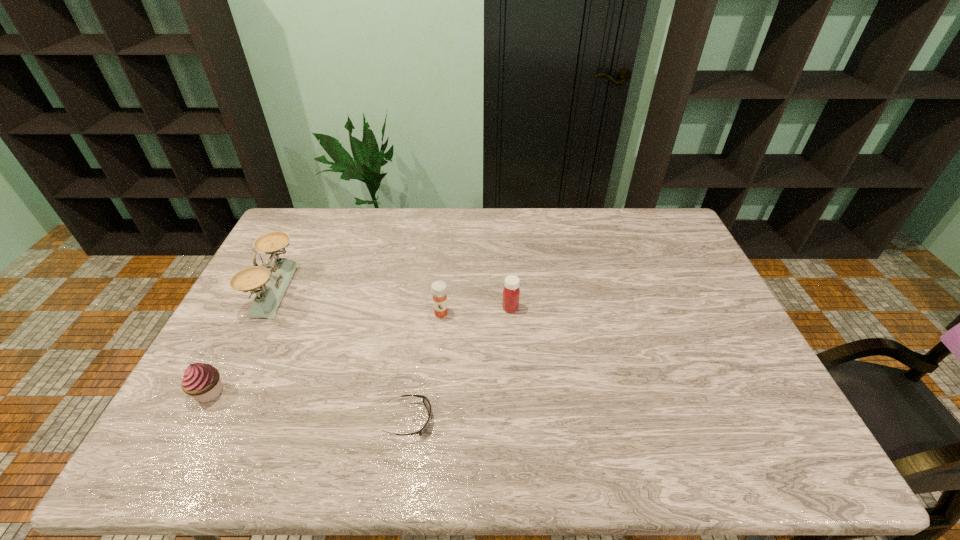
Identify the location of object that is at the near edge. (426, 402).

The height and width of the screenshot is (540, 960). I want to click on scale positioned at the left edge, so click(x=272, y=284).

Locate an element on the screen. cupcake present at the left edge is located at coordinates (202, 381).

This screenshot has height=540, width=960. In order to click on free space at the far edge of the desktop in this screenshot , I will do `click(597, 244)`.

The width and height of the screenshot is (960, 540). In order to click on vacant area at the near edge in this screenshot , I will do `click(652, 448)`.

Locate an element on the screen. vacant position at the left edge of the desktop is located at coordinates (291, 250).

The image size is (960, 540). Identify the location of vacant space at the right edge of the desktop. [x=777, y=416].

You are a GUI agent. You are given a task and a screenshot of the screen. Output one action in this format:
    pyautogui.click(x=<x>, y=<y>)
    Task: Click on the vacant area that lies between the scale and the cupcake
    The height and width of the screenshot is (540, 960).
    Given the screenshot: What is the action you would take?
    pyautogui.click(x=242, y=341)

The height and width of the screenshot is (540, 960). In order to click on free spot between the cupcake and the shortest object in this screenshot , I will do `click(309, 406)`.

You are a GUI agent. You are given a task and a screenshot of the screen. Output one action in this format:
    pyautogui.click(x=<x>, y=<y>)
    Task: Click on the empty space that is in between the left medicine and the cupcake
    
    Given the screenshot: What is the action you would take?
    pyautogui.click(x=325, y=353)